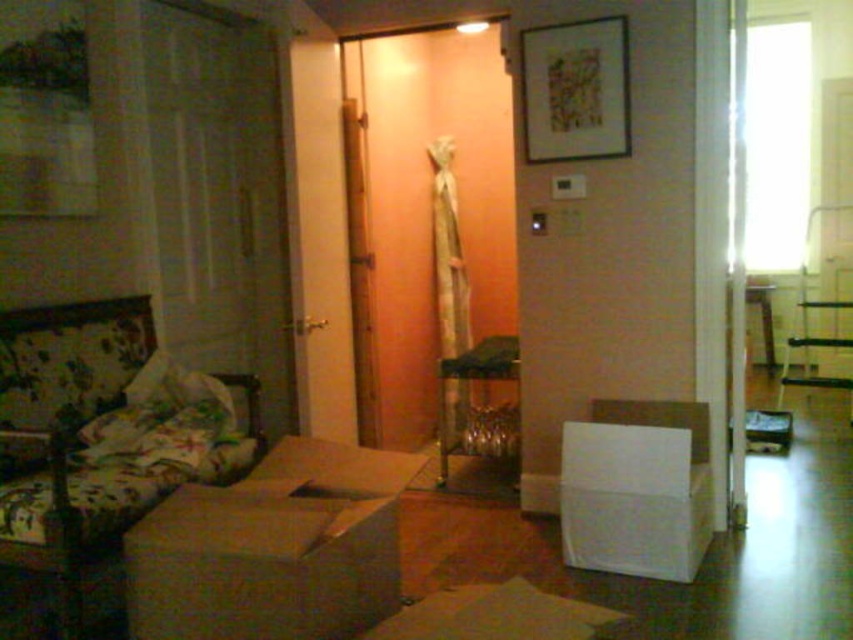
In the scene shown: You are moving into a new apartment and need to carry a white cardboard box at center through the hallway. There is a matte wooden picture frame at upper center on the wall. Considering their heights, which object might you need to be cautious about hitting your head on?

The white cardboard box at center is taller than the matte wooden picture frame at upper center, so you should be cautious about hitting your head on the white cardboard box at center while carrying it through the hallway.

You are moving into a new apartment and have a white cardboard box at center that you need to carry through this hallway. There is also a matte wooden picture frame at upper center on the wall. Considering their positions and sizes, can the box be moved past the frame without touching it?

The white cardboard box at center might be wider than matte wooden picture frame at upper center. Since the box could be wider, there is a risk of it touching the frame if moved directly past it. You should check the exact dimensions or move the box carefully to avoid contact.